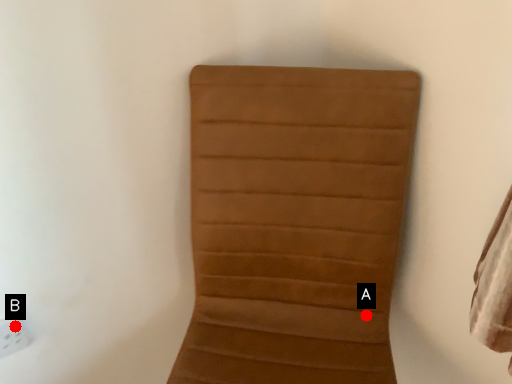
Question: Two points are circled on the image, labeled by A and B beside each circle. Among these points, which one is nearest to the camera?

Choices:
 (A) A is closer
 (B) B is closer

Answer: (B)